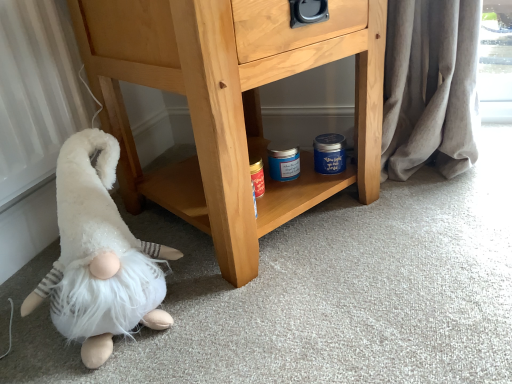
The width and height of the screenshot is (512, 384). What do you see at coordinates (99, 256) in the screenshot?
I see `white fluffy gnome at lower left` at bounding box center [99, 256].

Where is `white fluffy gnome at lower left`? This screenshot has width=512, height=384. white fluffy gnome at lower left is located at coordinates (99, 256).

Locate an element on the screen. Image resolution: width=512 pixels, height=384 pixels. light brown wood chest of drawers at center is located at coordinates click(x=229, y=105).

Describe the element at coordinates (229, 105) in the screenshot. The image size is (512, 384). I see `light brown wood chest of drawers at center` at that location.

The height and width of the screenshot is (384, 512). I want to click on white fluffy gnome at lower left, so click(x=99, y=256).

Is light brown wood chest of drawers at center at the right side of white fluffy gnome at lower left?

Yes, light brown wood chest of drawers at center is to the right of white fluffy gnome at lower left.

Which is in front, light brown wood chest of drawers at center or white fluffy gnome at lower left?

white fluffy gnome at lower left is more forward.

Which is behind, point (168, 184) or point (112, 168)?

The point (168, 184) is farther from the camera.

From the image's perspective, who appears lower, light brown wood chest of drawers at center or white fluffy gnome at lower left?

white fluffy gnome at lower left is shown below in the image.

From a real-world perspective, is light brown wood chest of drawers at center over white fluffy gnome at lower left?

Yes, from a real-world perspective, light brown wood chest of drawers at center is on top of white fluffy gnome at lower left.

Which object is wider, light brown wood chest of drawers at center or white fluffy gnome at lower left?

light brown wood chest of drawers at center.

Can you confirm if light brown wood chest of drawers at center is shorter than white fluffy gnome at lower left?

No, light brown wood chest of drawers at center is not shorter than white fluffy gnome at lower left.

Based on their sizes in the image, would you say light brown wood chest of drawers at center is bigger or smaller than white fluffy gnome at lower left?

Considering their sizes, light brown wood chest of drawers at center takes up more space than white fluffy gnome at lower left.

Which is correct: light brown wood chest of drawers at center is inside white fluffy gnome at lower left, or outside of it?

light brown wood chest of drawers at center exists outside the volume of white fluffy gnome at lower left.

Is light brown wood chest of drawers at center far away from white fluffy gnome at lower left?

No, light brown wood chest of drawers at center is not far from white fluffy gnome at lower left.

Is light brown wood chest of drawers at center looking in the opposite direction of white fluffy gnome at lower left?

light brown wood chest of drawers at center does not have its back to white fluffy gnome at lower left.

How many degrees apart are the facing directions of light brown wood chest of drawers at center and white fluffy gnome at lower left?

They differ by 7.68 degrees in their facing directions.

Where is `the chest of drawers that appears above the white fluffy gnome at lower left (from a real-world perspective)`? The width and height of the screenshot is (512, 384). the chest of drawers that appears above the white fluffy gnome at lower left (from a real-world perspective) is located at coordinates [229, 105].

Visually, is white fluffy gnome at lower left positioned to the left or to the right of light brown wood chest of drawers at center?

white fluffy gnome at lower left is to the left of light brown wood chest of drawers at center.

In the image, is white fluffy gnome at lower left positioned in front of or behind light brown wood chest of drawers at center?

white fluffy gnome at lower left is positioned closer to the viewer than light brown wood chest of drawers at center.

Which point is more forward, (139, 257) or (135, 203)?

The point (139, 257) is more forward.

From the image's perspective, does white fluffy gnome at lower left appear lower than light brown wood chest of drawers at center?

Result: Indeed, from the image's perspective, white fluffy gnome at lower left is shown beneath light brown wood chest of drawers at center.

From a real-world perspective, relative to light brown wood chest of drawers at center, is white fluffy gnome at lower left vertically above or below?

white fluffy gnome at lower left is situated lower than light brown wood chest of drawers at center in the real world.

Considering the relative sizes of white fluffy gnome at lower left and light brown wood chest of drawers at center in the image provided, is white fluffy gnome at lower left wider than light brown wood chest of drawers at center?

Incorrect, the width of white fluffy gnome at lower left does not surpass that of light brown wood chest of drawers at center.

Looking at this image, considering the relative sizes of white fluffy gnome at lower left and light brown wood chest of drawers at center in the image provided, is white fluffy gnome at lower left taller than light brown wood chest of drawers at center?

No.

Does white fluffy gnome at lower left have a smaller size compared to light brown wood chest of drawers at center?

Yes.

Which is correct: white fluffy gnome at lower left is inside light brown wood chest of drawers at center, or outside of it?

white fluffy gnome at lower left is spatially situated outside light brown wood chest of drawers at center.

Is white fluffy gnome at lower left far from light brown wood chest of drawers at center?

They are positioned close to each other.

Is white fluffy gnome at lower left facing away from light brown wood chest of drawers at center?

No, white fluffy gnome at lower left's orientation is not away from light brown wood chest of drawers at center.

How different are the orientations of white fluffy gnome at lower left and light brown wood chest of drawers at center in degrees?

They differ by 7.68 degrees in their facing directions.

Could you measure the distance between white fluffy gnome at lower left and light brown wood chest of drawers at center?

white fluffy gnome at lower left is 9.93 inches from light brown wood chest of drawers at center.

This screenshot has height=384, width=512. In order to click on chest of drawers behind the white fluffy gnome at lower left in this screenshot , I will do `click(229, 105)`.

You are a GUI agent. You are given a task and a screenshot of the screen. Output one action in this format:
    pyautogui.click(x=<x>, y=<y>)
    Task: Click on the toy that is below the light brown wood chest of drawers at center (from the image's perspective)
    This screenshot has width=512, height=384.
    Given the screenshot: What is the action you would take?
    pyautogui.click(x=99, y=256)

Find the location of a particular element. The height and width of the screenshot is (384, 512). the chest of drawers above the white fluffy gnome at lower left (from a real-world perspective) is located at coordinates (229, 105).